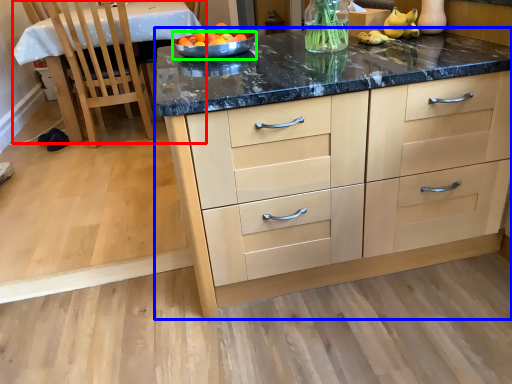
Question: Considering the real-world distances, which object is farthest from table (highlighted by a red box)? cabinetry (highlighted by a blue box) or bowl (highlighted by a green box)?

Choices:
 (A) cabinetry
 (B) bowl

Answer: (A)